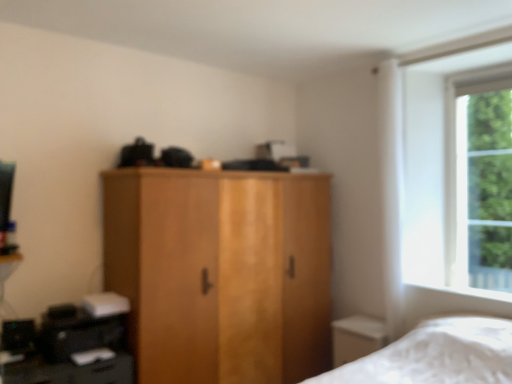
Question: Can you confirm if black plastic printer at lower left is shorter than green leafy tree at right?

Choices:
 (A) yes
 (B) no

Answer: (A)

Question: Considering the relative sizes of black plastic printer at lower left and green leafy tree at right in the image provided, is black plastic printer at lower left smaller than green leafy tree at right?

Choices:
 (A) yes
 (B) no

Answer: (B)

Question: From a real-world perspective, does black plastic printer at lower left stand above green leafy tree at right?

Choices:
 (A) no
 (B) yes

Answer: (A)

Question: Does black plastic printer at lower left have a larger size compared to green leafy tree at right?

Choices:
 (A) yes
 (B) no

Answer: (A)

Question: From the image's perspective, is black plastic printer at lower left under green leafy tree at right?

Choices:
 (A) no
 (B) yes

Answer: (B)

Question: Is green leafy tree at right taller or shorter than black plastic printer at lower left?

Choices:
 (A) short
 (B) tall

Answer: (B)

Question: Is green leafy tree at right in front of or behind black plastic printer at lower left in the image?

Choices:
 (A) front
 (B) behind

Answer: (B)

Question: From the image's perspective, is green leafy tree at right located above or below black plastic printer at lower left?

Choices:
 (A) above
 (B) below

Answer: (A)

Question: In terms of width, does green leafy tree at right look wider or thinner when compared to black plastic printer at lower left?

Choices:
 (A) wide
 (B) thin

Answer: (B)

Question: Based on their positions, is wooden wardrobe at center located to the left or right of green leafy tree at right?

Choices:
 (A) left
 (B) right

Answer: (A)

Question: In terms of height, does wooden wardrobe at center look taller or shorter compared to green leafy tree at right?

Choices:
 (A) tall
 (B) short

Answer: (A)

Question: Would you say wooden wardrobe at center is inside or outside green leafy tree at right?

Choices:
 (A) outside
 (B) inside

Answer: (A)

Question: From the image's perspective, relative to green leafy tree at right, is wooden wardrobe at center above or below?

Choices:
 (A) below
 (B) above

Answer: (A)

Question: Would you say wooden wardrobe at center is inside or outside black plastic printer at lower left?

Choices:
 (A) inside
 (B) outside

Answer: (B)

Question: Is point (316, 246) positioned closer to the camera than point (119, 362)?

Choices:
 (A) closer
 (B) farther

Answer: (B)